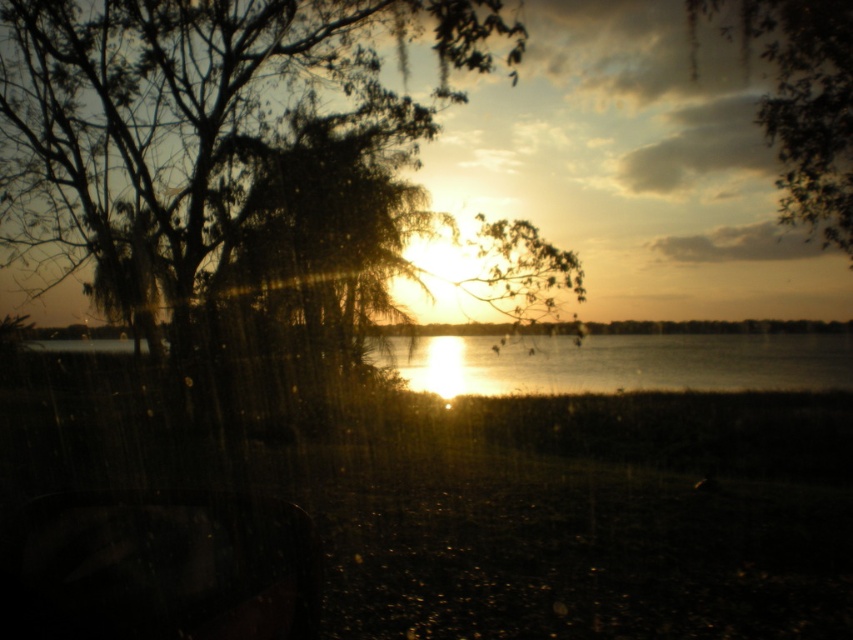
Question: Which object appears farthest from the camera in this image?

Choices:
 (A) green leafy tree at center
 (B) green leafy tree at upper center
 (C) glistening silver water at center

Answer: (C)

Question: Among these objects, which one is farthest from the camera?

Choices:
 (A) green leafy tree at center
 (B) glistening silver water at center

Answer: (B)

Question: Does green leafy tree at center appear on the left side of green leafy tree at upper center?

Choices:
 (A) no
 (B) yes

Answer: (B)

Question: Estimate the real-world distances between objects in this image. Which object is closer to the glistening silver water at center?

Choices:
 (A) green leafy tree at upper center
 (B) green leafy tree at center

Answer: (B)

Question: Can you confirm if glistening silver water at center is bigger than green leafy tree at upper center?

Choices:
 (A) yes
 (B) no

Answer: (A)

Question: Observing the image, what is the correct spatial positioning of glistening silver water at center in reference to green leafy tree at upper center?

Choices:
 (A) right
 (B) left

Answer: (A)